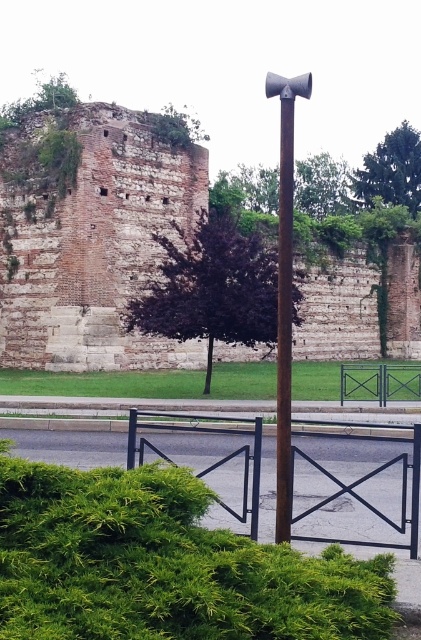
Can you confirm if rusty metal pole at center is shorter than polished metal pole at center?

No.

Is point (287, 216) more distant than point (284, 276)?

No, (287, 216) is closer to viewer.

Is point (290, 349) positioned in front of point (285, 212)?

Yes, point (290, 349) is in front of point (285, 212).

Where is `rusty metal pole at center`? rusty metal pole at center is located at coordinates (285, 289).

Can you confirm if rusty metal pole at center is positioned above green metal gate at center?

Yes.

Between rusty metal pole at center and green metal gate at center, which one is positioned lower?

green metal gate at center is lower down.

Who is more distant from viewer, (x=277, y=81) or (x=362, y=397)?

The point (x=362, y=397) is more distant.

This screenshot has width=421, height=640. In order to click on rusty metal pole at center in this screenshot , I will do `click(285, 289)`.

Find the location of a particular element. Image resolution: width=421 pixels, height=640 pixels. rusty metal pole at center is located at coordinates (285, 289).

What do you see at coordinates (285, 289) in the screenshot?
I see `rusty metal pole at center` at bounding box center [285, 289].

Locate an element on the screen. rusty metal pole at center is located at coordinates (285, 289).

This screenshot has height=640, width=421. Identify the location of rusty metal pole at center. (285, 289).